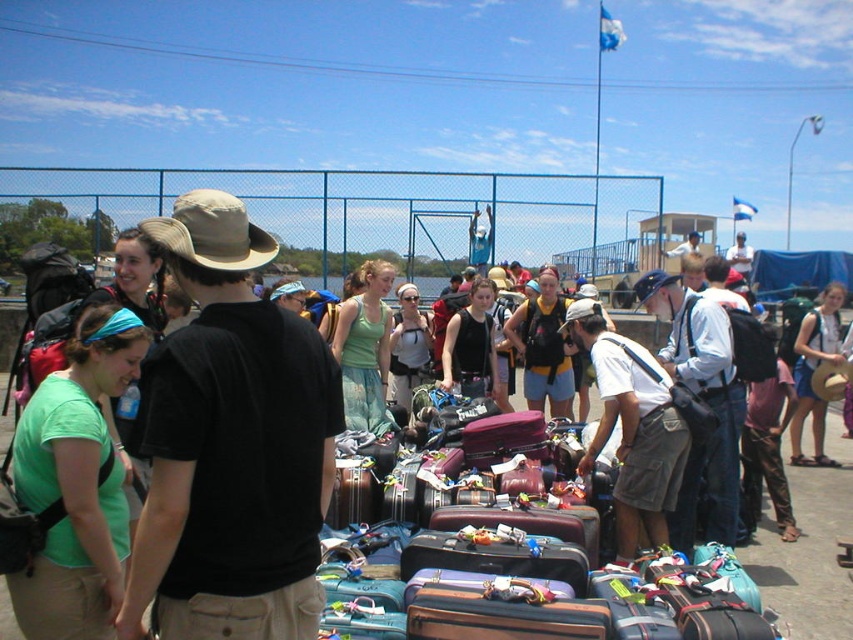
You are a photographer trying to capture a person wearing both the khaki shorts at center and the matte white tank top at center. Based on their positions, which clothing item is located to the right of the other?

The khaki shorts at center is positioned on the right side of matte white tank top at center.

You are standing at the dock and see the brown straw hat at center and the black matte tank top at center. Which item is positioned lower from the ground?

The brown straw hat at center is positioned below the black matte tank top at center, so the brown straw hat at center is lower from the ground.